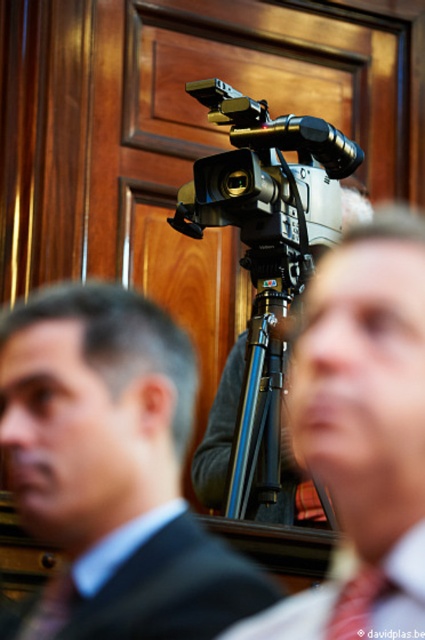
You are a photographer setting up a shot in a formal courtroom scene. You notice the white cotton dress shirt at center and the red silk tie at center. Which of these two items is taller in the frame?

The white cotton dress shirt at center is taller than the red silk tie at center according to the description.

You are a photographer adjusting the focus on your matte black camera at center. You notice a person wearing a matte black suit at center in your frame. Which object in the scene is smaller?

The matte black suit at center is smaller than the matte black camera at center.

You are standing at the point marked at coordinates point (357, 564) in a courtroom setting. You need to walk to the camera mounted centrally. How far will you have to walk in feet?

The distance between point (357, 564) and the camera is 42.56 feet, so you will have to walk 42.56 feet to reach the camera.